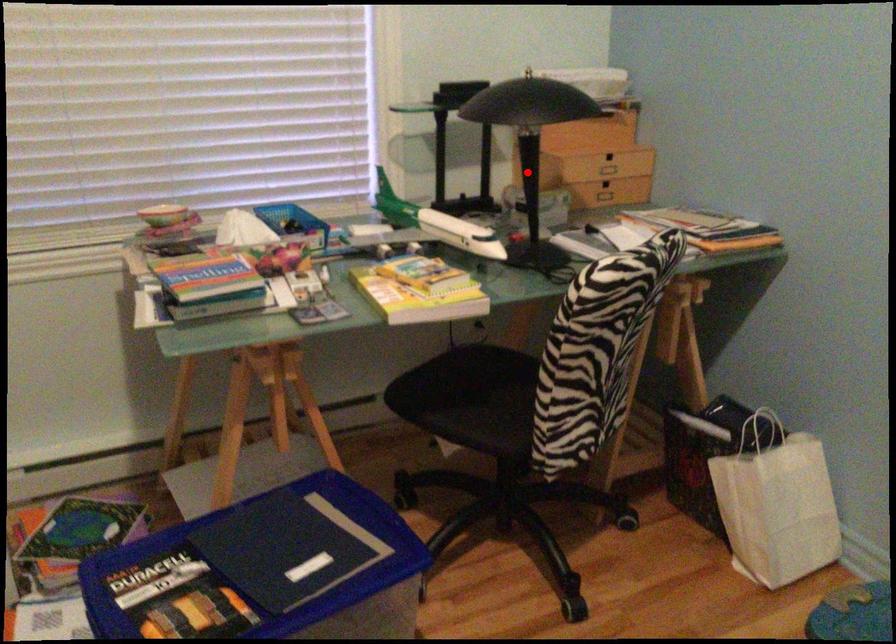
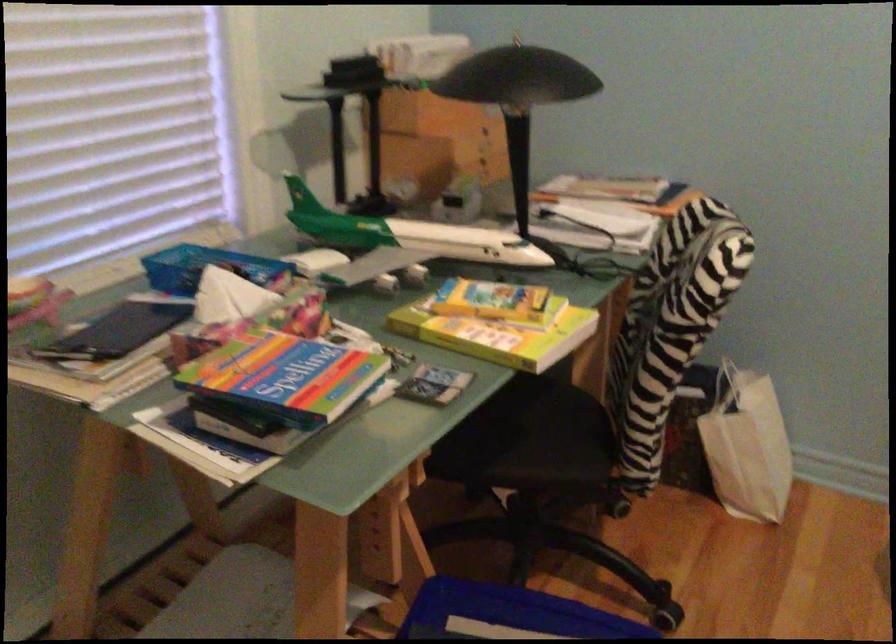
Question: I am providing you with two images of the same scene from different viewpoints. Image1 has a red point marked. In image2, the corresponding 3D location appears at what relative position? Reply with the corresponding letter.

Choices:
 (A) Closer
 (B) Farther

Answer: (A)